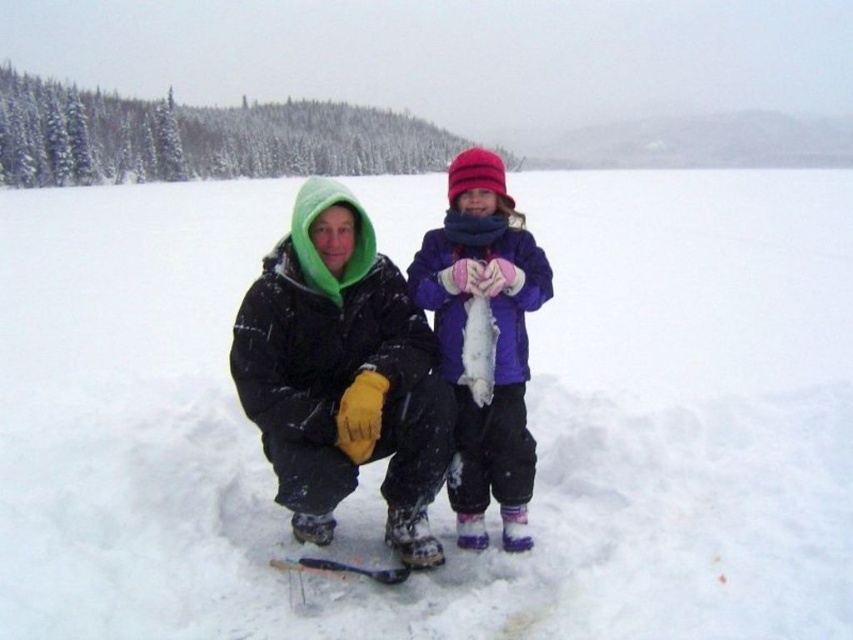
Question: Is matte black jacket at center thinner than purple fleece jacket at center?

Choices:
 (A) yes
 (B) no

Answer: (B)

Question: Observing the image, what is the correct spatial positioning of matte black jacket at center in reference to purple fleece jacket at center?

Choices:
 (A) below
 (B) above

Answer: (B)

Question: Which of the following is the closest to the observer?

Choices:
 (A) white fluffy snow at center
 (B) matte black jacket at center

Answer: (A)

Question: Does white fluffy snow at center appear on the right side of matte black jacket at center?

Choices:
 (A) yes
 (B) no

Answer: (B)

Question: Estimate the real-world distances between objects in this image. Which object is farther from the white fluffy snow at center?

Choices:
 (A) matte black jacket at center
 (B) purple fleece jacket at center

Answer: (B)

Question: Which of the following is the closest to the observer?

Choices:
 (A) white fluffy snow at center
 (B) matte black jacket at center
 (C) purple fleece jacket at center

Answer: (A)